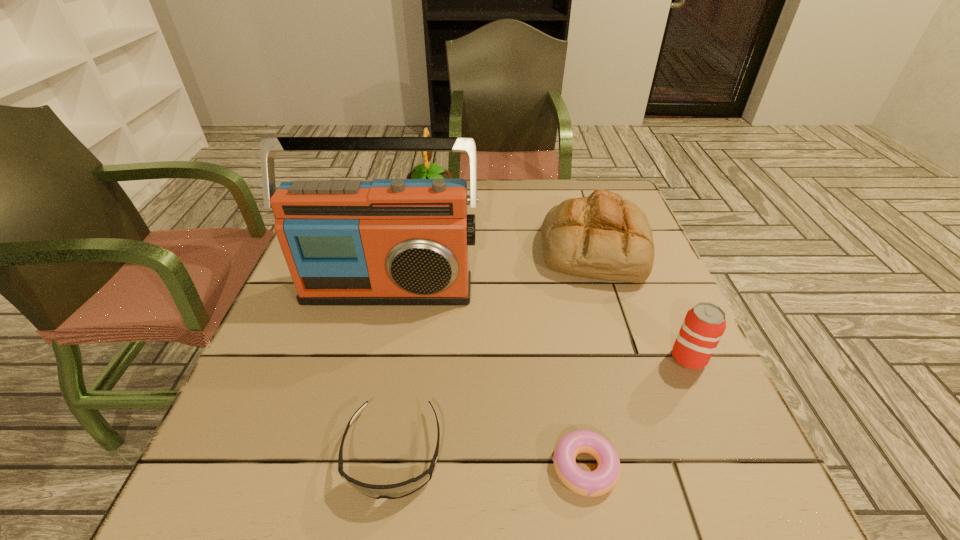
Image resolution: width=960 pixels, height=540 pixels. I want to click on vacant space that satisfies the following two spatial constraints: 1. on the lenses of the goggles; 2. on the right side of the doughnut, so click(x=392, y=467).

This screenshot has height=540, width=960. Identify the location of free region that satisfies the following two spatial constraints: 1. on the lenses of the shortest object; 2. on the right side of the second shortest object. (392, 467).

I want to click on blank area in the image that satisfies the following two spatial constraints: 1. on the lenses of the shortest object; 2. on the right side of the second shortest object, so click(392, 467).

The image size is (960, 540). I want to click on free space that satisfies the following two spatial constraints: 1. on the face of the sunflower; 2. on the front-facing side of the radio receiver, so click(415, 289).